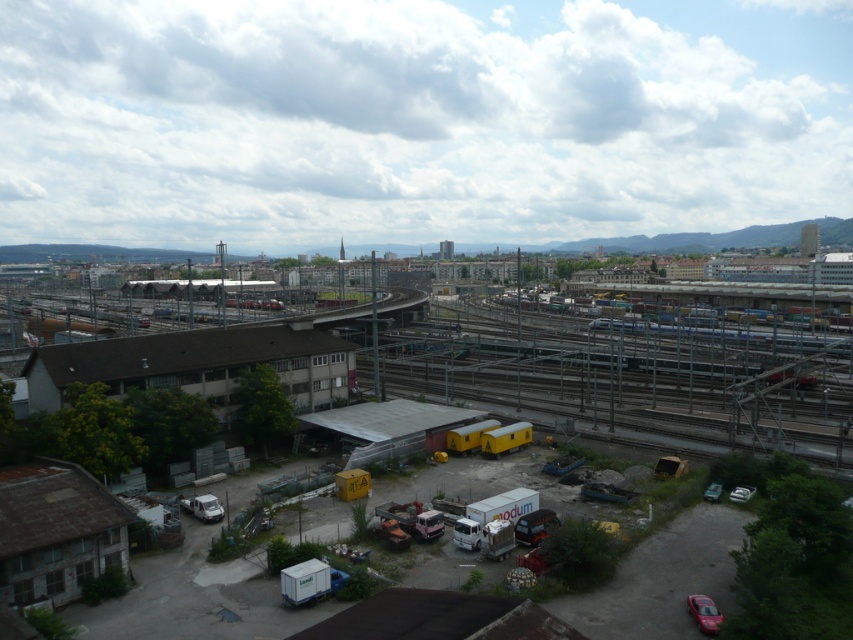
Who is positioned more to the right, yellow matte train cars at center or metallic silver car at lower right?

metallic silver car at lower right

Is point (190, 620) positioned behind point (743, 484)?

No, it is in front of (743, 484).

Identify the location of yellow matte train cars at center. This screenshot has height=640, width=853. (192, 600).

Can you confirm if shiny red car at bottom right is positioned to the right of metallic silver car at lower right?

Incorrect, shiny red car at bottom right is not on the right side of metallic silver car at lower right.

Is shiny red car at bottom right bigger than metallic silver car at lower right?

Indeed, shiny red car at bottom right has a larger size compared to metallic silver car at lower right.

You are a GUI agent. You are given a task and a screenshot of the screen. Output one action in this format:
    pyautogui.click(x=<x>, y=<y>)
    Task: Click on the shiny red car at bottom right
    The image size is (853, 640).
    Given the screenshot: What is the action you would take?
    pyautogui.click(x=704, y=612)

Between yellow matte train cars at center and shiny red car at bottom right, which one is positioned lower?

shiny red car at bottom right

Can you confirm if yellow matte train cars at center is positioned to the right of shiny red car at bottom right?

No, yellow matte train cars at center is not to the right of shiny red car at bottom right.

Identify the location of yellow matte train cars at center. The image size is (853, 640). (192, 600).

Locate an element on the screen. The height and width of the screenshot is (640, 853). yellow matte train cars at center is located at coordinates (192, 600).